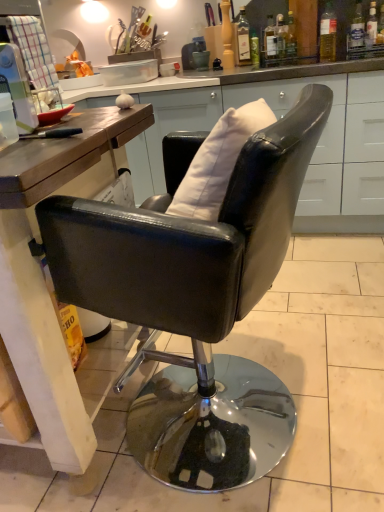
Question: From the image's perspective, is translucent glass bottle at upper right, the 5th bottle from the right, above or below translucent glass bottle at upper right, acting as the 3th bottle starting from the right?

Choices:
 (A) below
 (B) above

Answer: (A)

Question: Is point (276, 31) positioned closer to the camera than point (329, 38)?

Choices:
 (A) closer
 (B) farther

Answer: (B)

Question: Which of these objects is positioned farthest from the translucent glass bottle at upper right, the 5th bottle from the right?

Choices:
 (A) translucent glass bottle at upper right, which is the sixth bottle in left-to-right order
 (B) clear glass bottle at upper right, which is the 1th bottle in right-to-left order
 (C) translucent glass bottle at upper center, which appears as the eighth bottle when viewed from the right
 (D) matte wood countertop at center
 (E) black leather chair at center

Answer: (E)

Question: Which object is the farthest from the translucent glass bottle at upper center, acting as the 1th bottle starting from the left?

Choices:
 (A) black leather chair at center
 (B) translucent glass bottle at upper right, acting as the 3th bottle starting from the right
 (C) clear glass bottle at upper right, which is the 1th bottle in right-to-left order
 (D) translucent glass bottle at upper center, arranged as the 2th bottle when viewed from the left
 (E) matte wood countertop at center

Answer: (A)